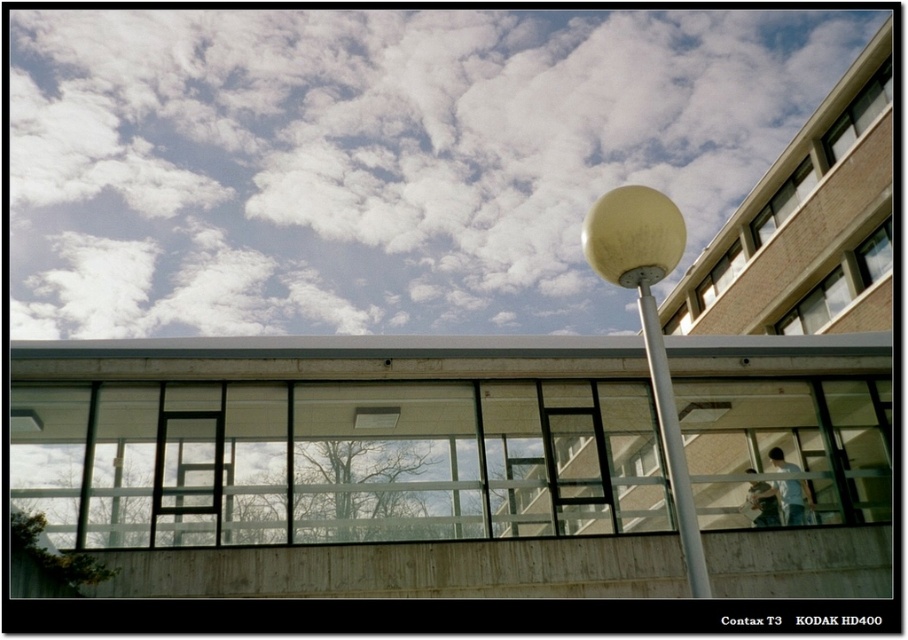
Is point (51, 324) less distant than point (180, 502)?

No, (51, 324) is further to viewer.

Where is `white fluffy cloud at upper center`? The width and height of the screenshot is (908, 640). white fluffy cloud at upper center is located at coordinates (377, 160).

Who is shorter, white fluffy cloud at upper center or metallic silver pole at center?

With less height is metallic silver pole at center.

Does white fluffy cloud at upper center have a greater width compared to metallic silver pole at center?

Indeed, white fluffy cloud at upper center has a greater width compared to metallic silver pole at center.

Is point (358, 97) positioned behind point (660, 244)?

Yes, point (358, 97) is behind point (660, 244).

Locate an element on the screen. The height and width of the screenshot is (640, 908). white fluffy cloud at upper center is located at coordinates (377, 160).

Is metallic silver pole at center further to camera compared to metallic silver ladder at center?

No, it is not.

Is metallic silver pole at center bigger than metallic silver ladder at center?

Incorrect, metallic silver pole at center is not larger than metallic silver ladder at center.

The image size is (908, 640). What are the coordinates of `metallic silver pole at center` in the screenshot? It's located at (649, 324).

This screenshot has height=640, width=908. Find the location of `metallic silver pole at center`. metallic silver pole at center is located at coordinates (649, 324).